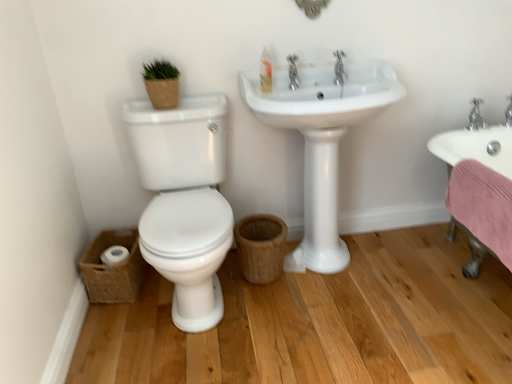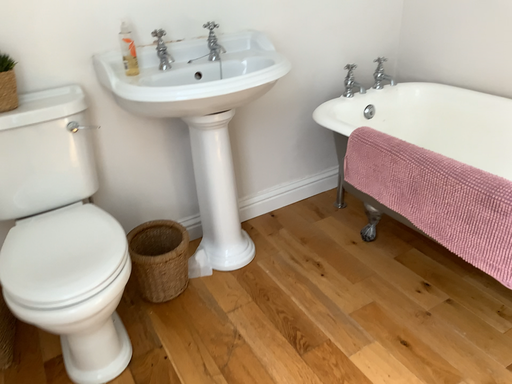
Question: How did the camera likely rotate when shooting the video?

Choices:
 (A) rotated right
 (B) rotated left

Answer: (A)